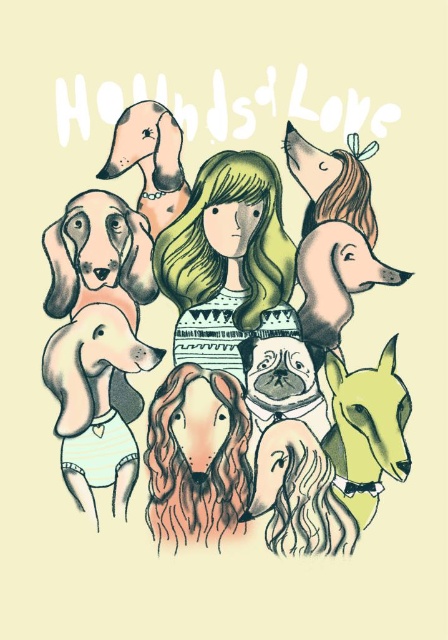
Can you confirm if matte green dress at center is smaller than smooth beige dog at upper left?

Incorrect, matte green dress at center is not smaller in size than smooth beige dog at upper left.

Which is in front, point (235, 348) or point (185, 205)?

Point (185, 205) is in front.

Find the location of `matte green dress at center`. matte green dress at center is located at coordinates (228, 260).

Who is higher up, pastel watercolor dogs at center or smooth beige dog at upper left?

Positioned higher is smooth beige dog at upper left.

Between point (240, 173) and point (116, 147), which one is positioned in front?

Positioned in front is point (116, 147).

Find the location of a particular element. The image size is (448, 640). pastel watercolor dogs at center is located at coordinates (235, 346).

Is pastel watercolor dogs at center shorter than matte green dress at center?

Incorrect, pastel watercolor dogs at center's height does not fall short of matte green dress at center's.

Between point (215, 244) and point (251, 172), which one is positioned behind?

Point (215, 244)

Who is more forward, (155, 113) or (203, 289)?

Positioned in front is point (155, 113).

I want to click on pastel watercolor dogs at center, so click(235, 346).